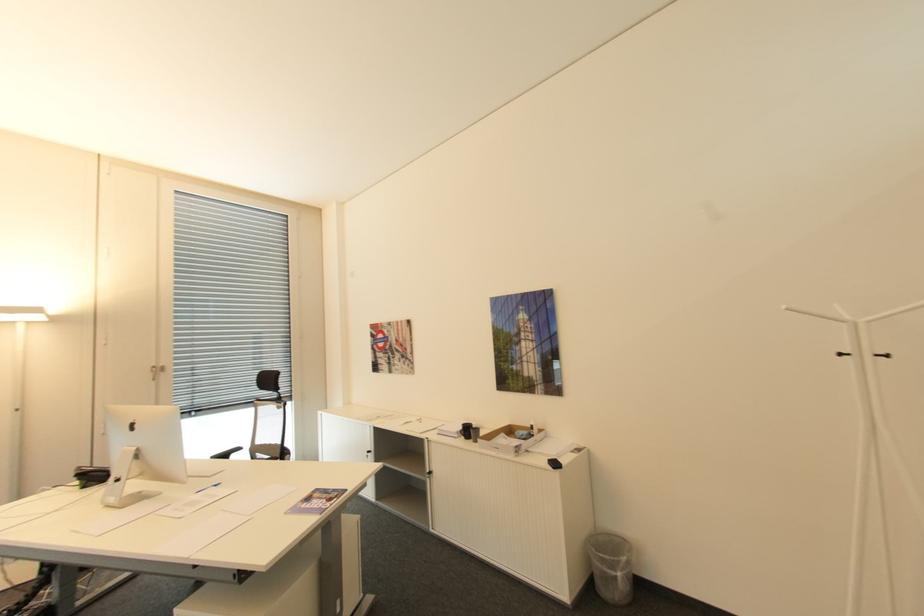
The image size is (924, 616). In order to click on white tape dispenser in this screenshot , I will do `click(141, 448)`.